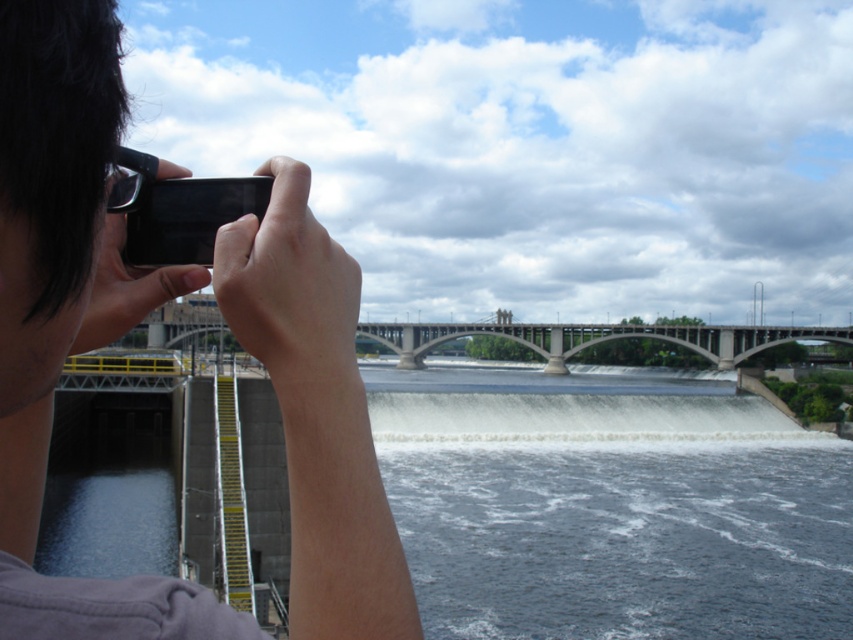
You are a photographer aiming to capture the entire bridge and dam in your shot. Your matte black phone at upper left is 15.11 meters away from the camera. Can you fit both the bridge and dam into your current camera frame without moving the camera?

The matte black phone at upper left is 15.11 meters away from the camera. Since the phone is positioned at the upper left corner of the frame, it indicates that the camera is focused on the distant bridge and dam. Therefore, both the bridge and dam should already be within the current camera frame.